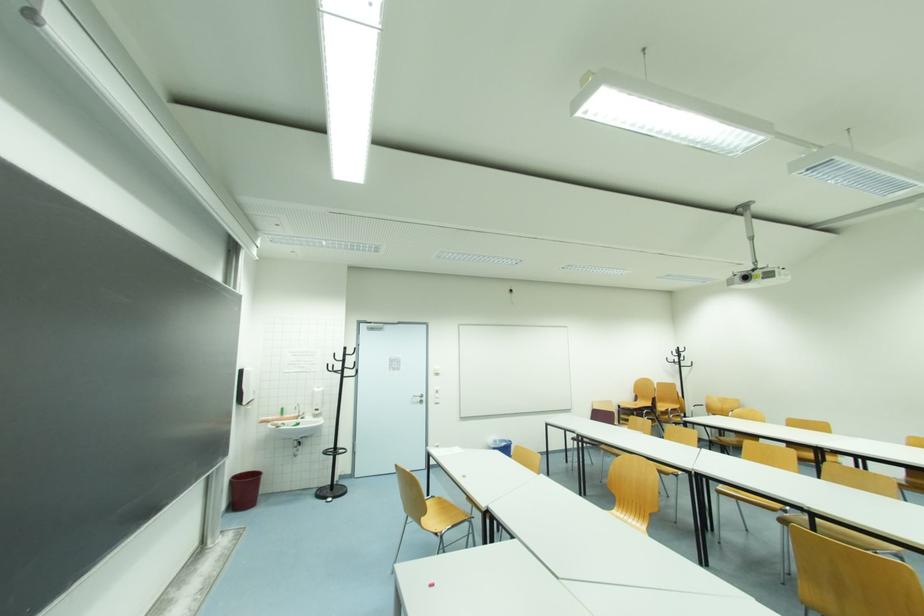
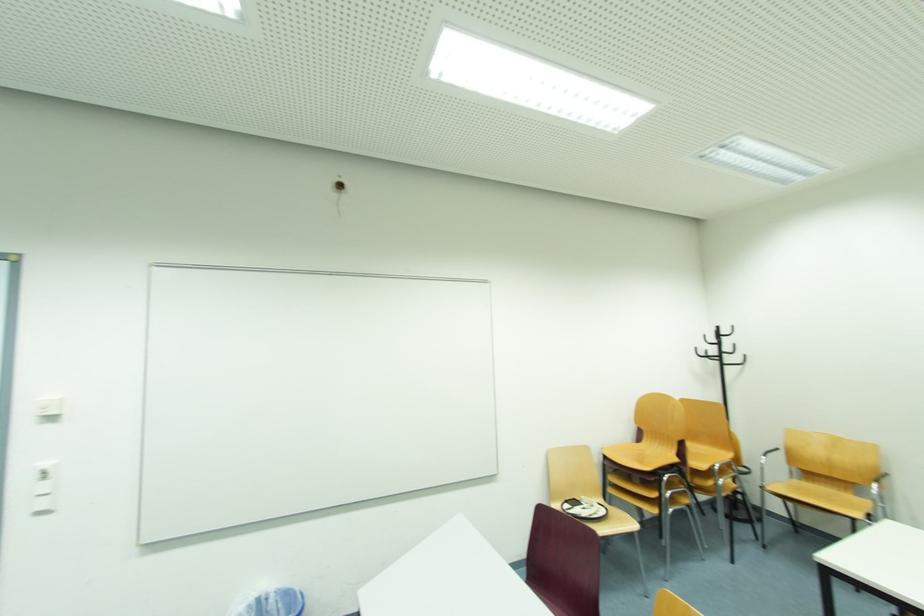
In the scene shown: In a continuous first-person perspective shot, in which direction is the camera moving?

The cameraman moved toward right, forward.